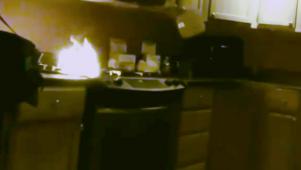
You are a GUI agent. You are given a task and a screenshot of the screen. Output one action in this format:
    pyautogui.click(x=<x>, y=<y>)
    Task: Click on the stove
    This screenshot has height=170, width=301.
    Given the screenshot: What is the action you would take?
    pyautogui.click(x=143, y=107)